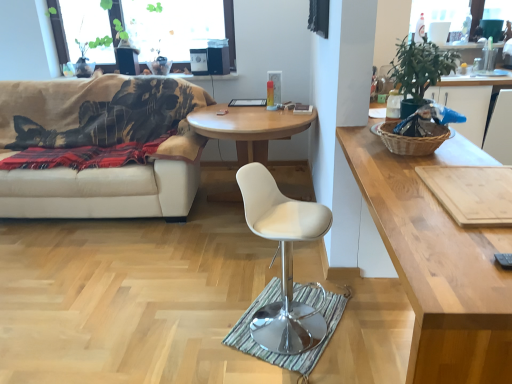
Identify the location of free region on the left part of textured woven mat at center. (180, 336).